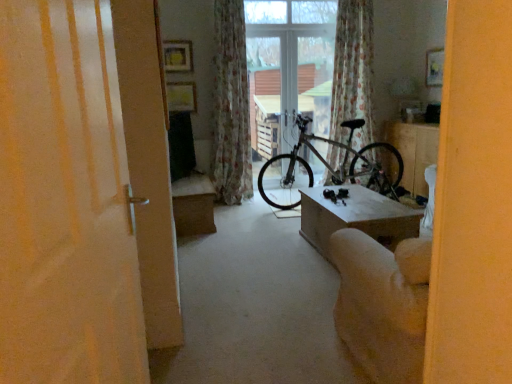
Locate an element on the screen. Image resolution: width=512 pixels, height=384 pixels. vacant region to the left of light brown wooden table at center, which ranks as the first table in left-to-right order is located at coordinates (258, 252).